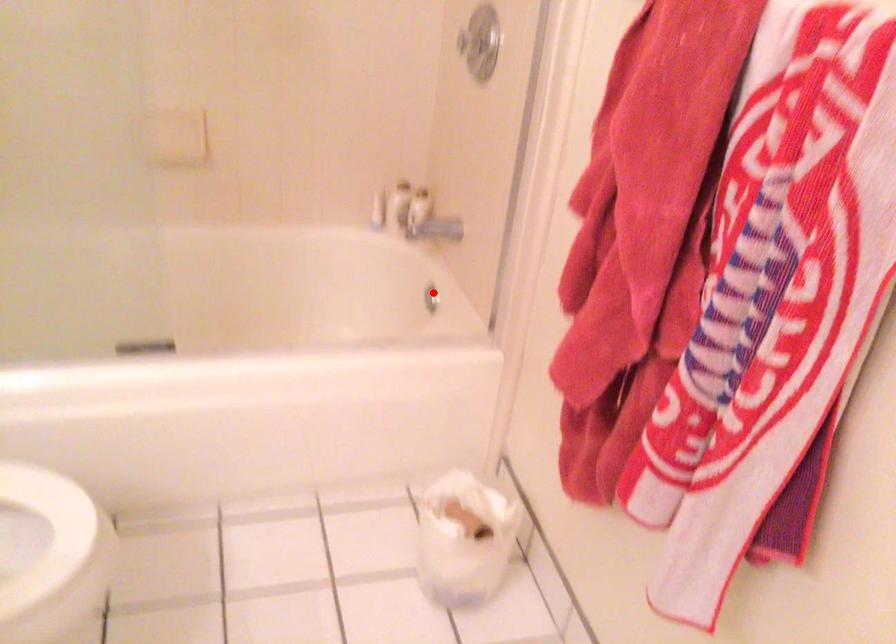
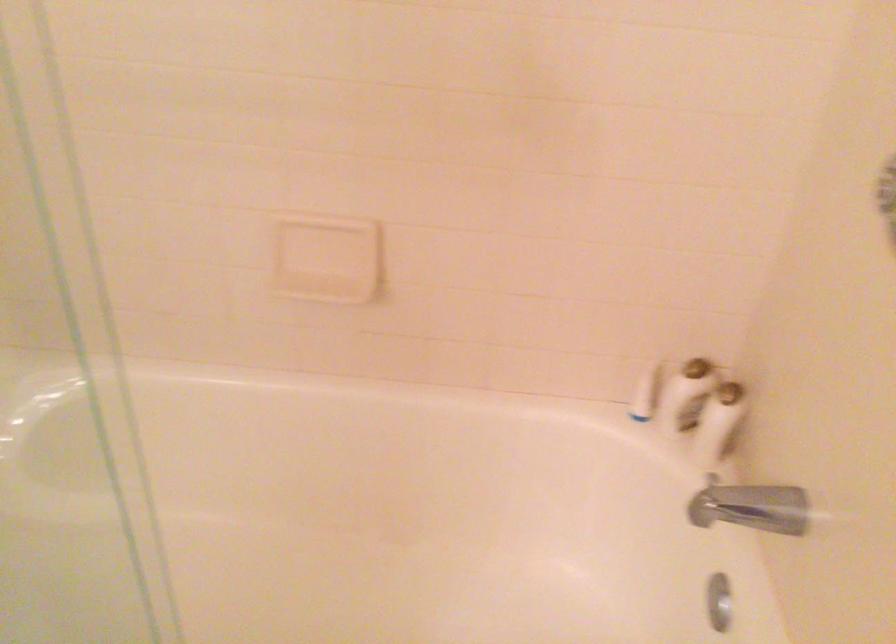
Question: I am providing you with two images of the same scene from different viewpoints. A red point is shown in image1. For the corresponding object point in image2, is it positioned nearer or farther from the camera?

Choices:
 (A) Nearer
 (B) Farther

Answer: (A)